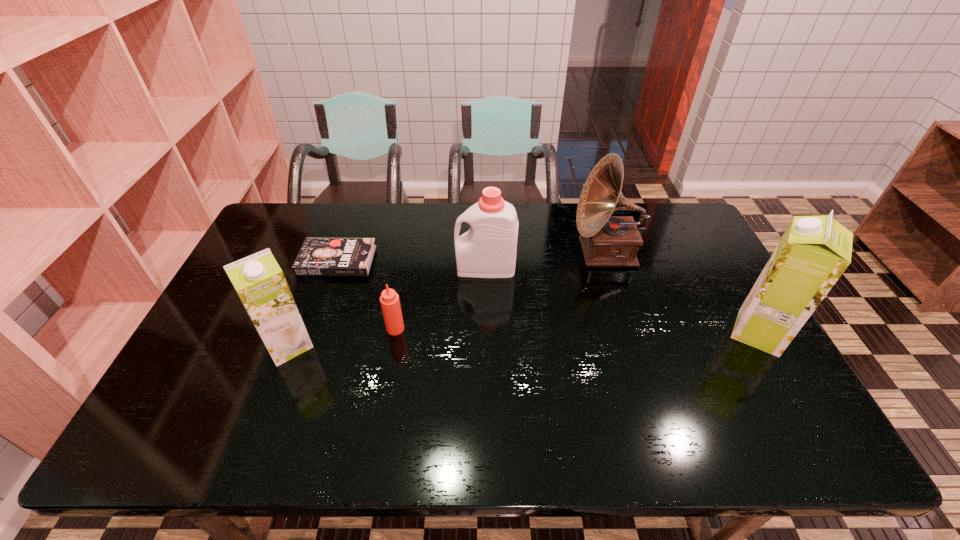
Image resolution: width=960 pixels, height=540 pixels. In order to click on free space between the fourth object from left to right and the shortest object in this screenshot , I will do `click(411, 264)`.

Locate an element on the screen. Image resolution: width=960 pixels, height=540 pixels. vacant area between the right soya milk and the fourth object from right to left is located at coordinates (577, 330).

This screenshot has height=540, width=960. What are the coordinates of `vacant point located between the shorter soya milk and the Tabasco sauce` in the screenshot? It's located at (342, 337).

Identify which object is the third nearest to the fourth object from right to left. Please provide its 2D coordinates. Your answer should be formatted as a tuple, i.e. [(x, y)], where the tuple contains the x and y coordinates of a point satisfying the conditions above.

[(488, 249)]

Find the location of a particular element. This screenshot has height=540, width=960. object that stands as the fourth closest to the book is located at coordinates (607, 241).

This screenshot has width=960, height=540. In order to click on vacant space that satisfies the following two spatial constraints: 1. on the handle side of the third object from right to left; 2. on the back side of the rightmost object in this screenshot , I will do `click(487, 333)`.

The height and width of the screenshot is (540, 960). Identify the location of free spot that satisfies the following two spatial constraints: 1. on the handle side of the fourth object from left to right; 2. on the front side of the Tabasco sauce. (487, 328).

I want to click on vacant space that satisfies the following two spatial constraints: 1. on the back side of the book; 2. on the right side of the left soya milk, so click(x=321, y=260).

What are the coordinates of `free location that satisfies the following two spatial constraints: 1. on the back side of the left soya milk; 2. on the left side of the book` in the screenshot? It's located at (321, 260).

You are a GUI agent. You are given a task and a screenshot of the screen. Output one action in this format:
    pyautogui.click(x=<x>, y=<y>)
    Task: Click on the vacant point that satisfies the following two spatial constraints: 1. on the front side of the shortest object; 2. on the right side of the taller soya milk
    
    Given the screenshot: What is the action you would take?
    pyautogui.click(x=312, y=333)